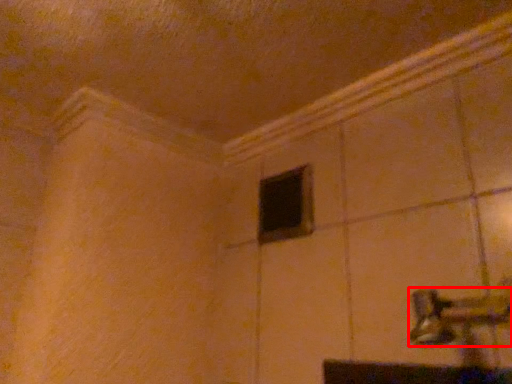
Question: From the image's perspective, what is the correct spatial relationship of door handle (annotated by the red box) in relation to window?

Choices:
 (A) below
 (B) above

Answer: (A)